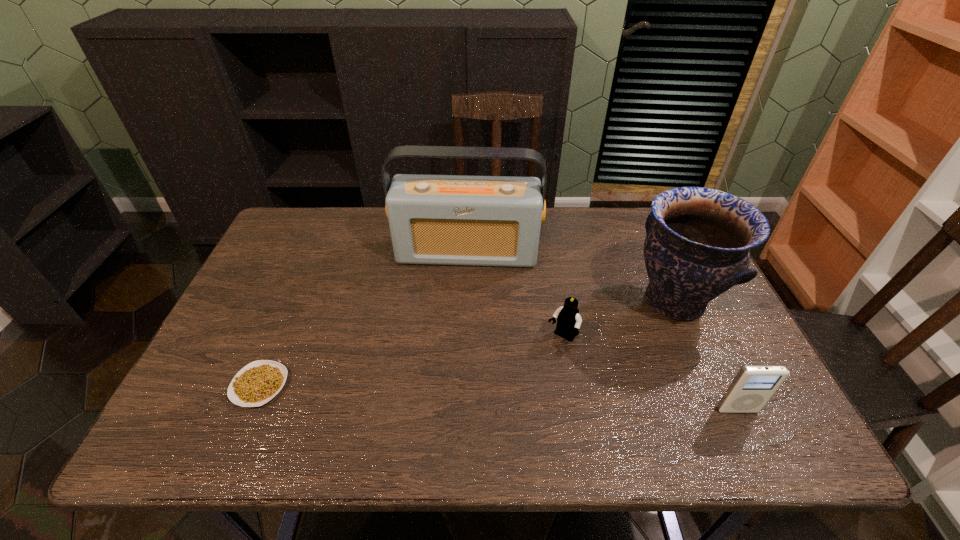
The image size is (960, 540). Identify the location of free spot between the tallest object and the iPod. (602, 331).

Locate an element on the screen. This screenshot has width=960, height=540. free space between the Lego and the radio receiver is located at coordinates (515, 295).

The image size is (960, 540). What are the coordinates of `unoccupied area between the Lego and the pottery` in the screenshot? It's located at (618, 320).

Identify the location of free space between the fourth shortest object and the iPod. (706, 355).

You are a GUI agent. You are given a task and a screenshot of the screen. Output one action in this format:
    pyautogui.click(x=<x>, y=<y>)
    Task: Click on the free area in between the tallest object and the iPod
    The width and height of the screenshot is (960, 540).
    Given the screenshot: What is the action you would take?
    pyautogui.click(x=602, y=331)

You are a GUI agent. You are given a task and a screenshot of the screen. Output one action in this format:
    pyautogui.click(x=<x>, y=<y>)
    Task: Click on the vacant space in between the iPod and the Lego
    The height and width of the screenshot is (540, 960).
    Given the screenshot: What is the action you would take?
    pyautogui.click(x=650, y=374)

Find the location of a particular element. This screenshot has height=540, width=960. vacant area that lies between the tallest object and the Lego is located at coordinates (515, 295).

Identify the location of vacant area that lies between the fourth tallest object and the third shortest object. (650, 374).

What are the coordinates of `vacant space that's between the fourth tallest object and the radio receiver` in the screenshot? It's located at (515, 295).

The image size is (960, 540). In order to click on the second closest object to the iPod in this screenshot , I will do `click(569, 320)`.